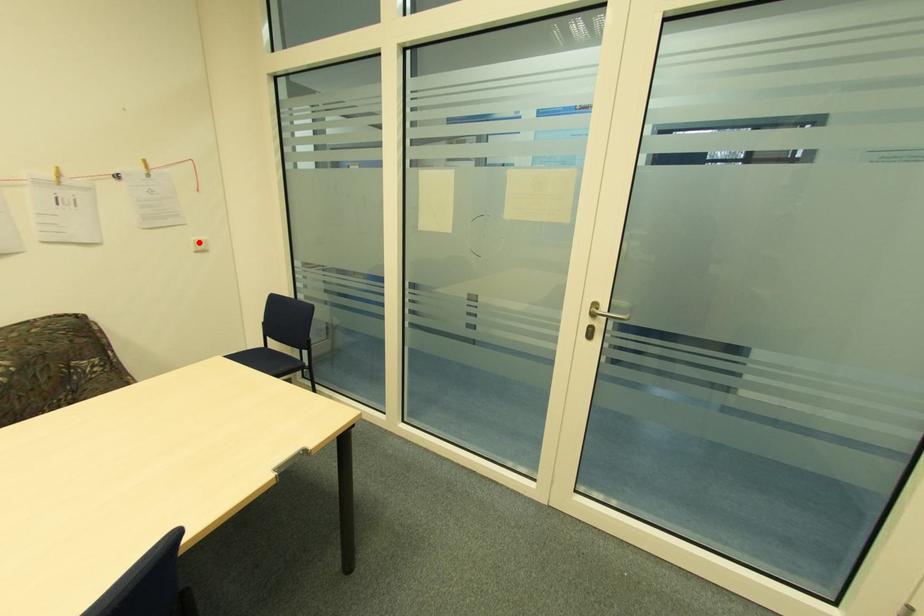
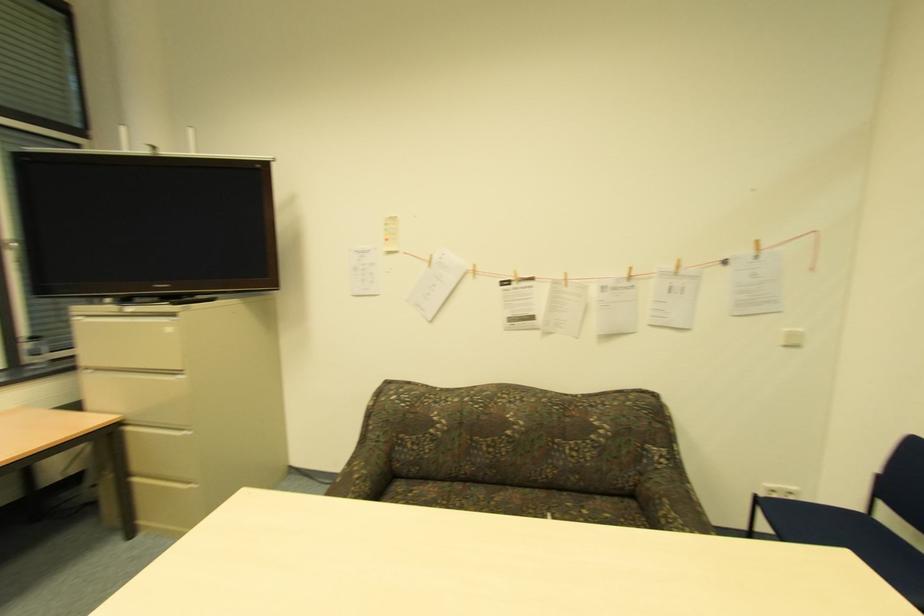
Locate, in the second image, the point that corresponds to the highlighted location in the first image.

(792, 334)